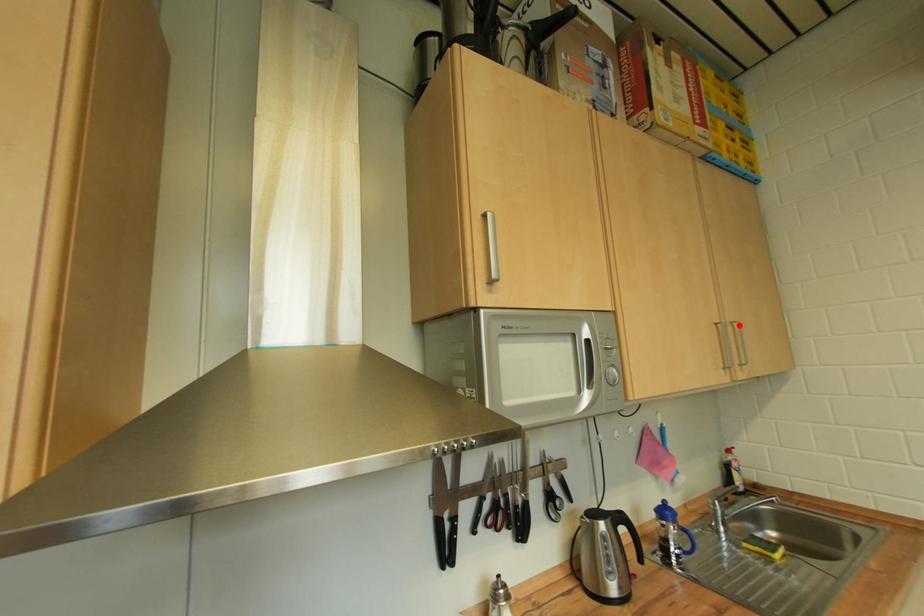
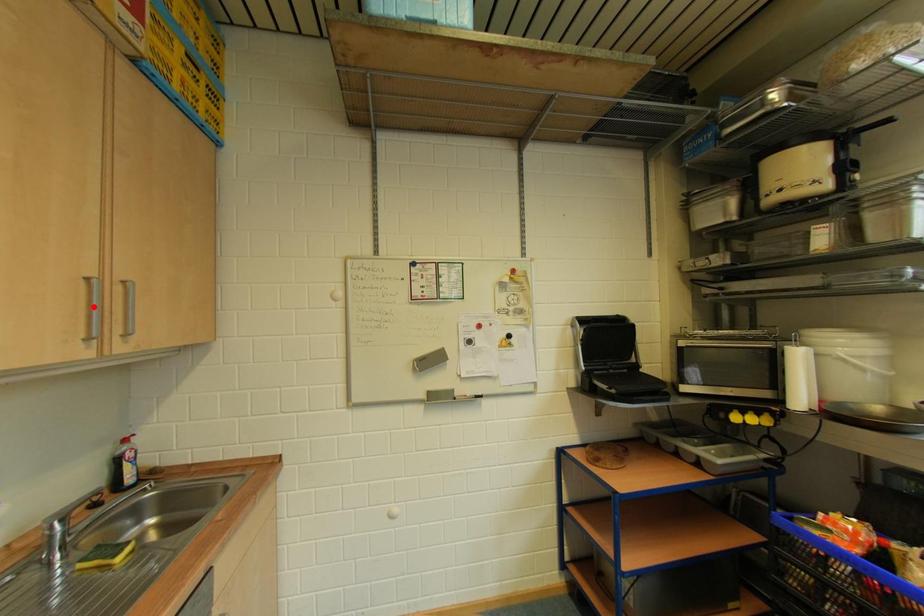
I am providing you with two images of the same scene from different viewpoints. A red point is marked on the first image and another point is marked on the second image. Are the points marked in image1 and image2 representing the same 3D position?

No